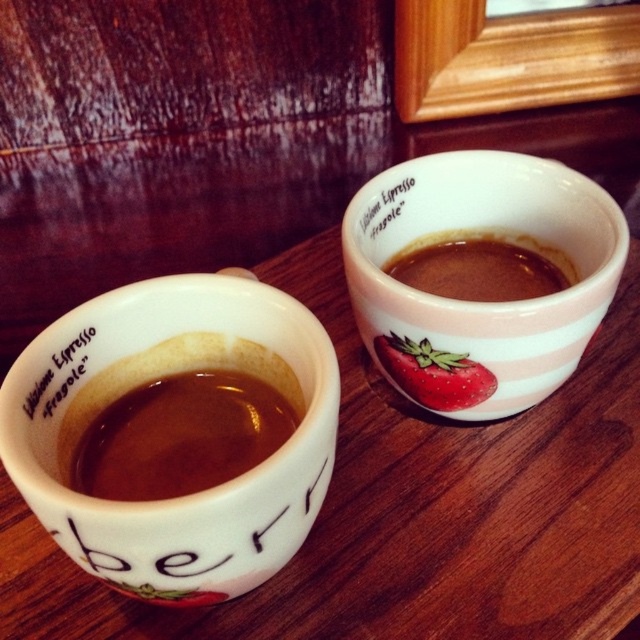
Question: Where is white matte espresso cup at left located in relation to white matte text at upper left in the image?

Choices:
 (A) left
 (B) right

Answer: (B)

Question: Among these objects, which one is farthest from the camera?

Choices:
 (A) white matte espresso cup at left
 (B) pink glossy mug at upper center

Answer: (B)

Question: Among these points, which one is nearest to the camera?

Choices:
 (A) (305, 388)
 (B) (380, 202)
 (C) (214, 390)
 (D) (541, 289)

Answer: (A)

Question: Which of the following is the closest to the observer?

Choices:
 (A) (461, 316)
 (B) (236, 458)
 (C) (170, 499)

Answer: (C)

Question: Can you confirm if white matte espresso cup at left is smaller than white matte text at upper left?

Choices:
 (A) no
 (B) yes

Answer: (A)

Question: In this image, where is brown matte espresso at left located relative to white matte text at upper center?

Choices:
 (A) right
 (B) left

Answer: (B)